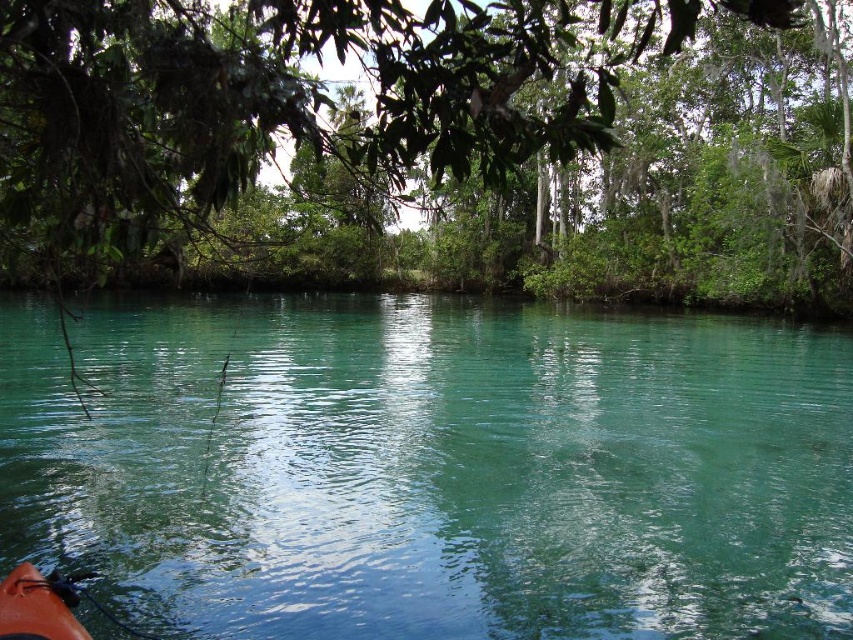
You are standing at the edge of the water and want to take a photo of the green leafy tree at upper center without the teal glossy water at center appearing in the frame. Which direction should you face to ensure the tree is visible but the water is not?

To avoid capturing the teal glossy water at center while photographing the green leafy tree at upper center, you should face to the left side, as the water is positioned to the right of the tree.

You are an environmental scientist assessing the ecosystem health of the area. You observe the teal glossy water at center and the green leafy tree at upper center. Which object occupies a larger area in the scene?

The green leafy tree at upper center occupies a larger area in the scene compared to the teal glossy water at center, as stated in the description that the teal glossy water at center has a smaller size compared to green leafy tree at upper center.

You are standing in the serene natural scene and want to take a photo of the orange matte kayak at lower left. However, you notice the green leafy tree at upper center is blocking your view. Can you determine if the tree is closer to you than the kayak?

The green leafy tree at upper center is closer to the viewer than the orange matte kayak at lower left, so it will block your view of the kayak.